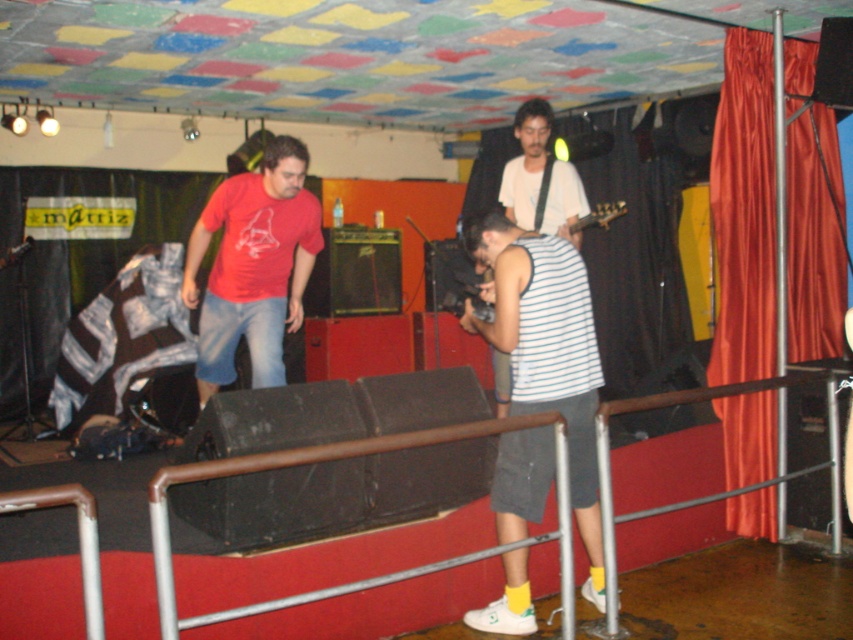
Question: Which point is farther to the camera?

Choices:
 (A) 552,268
 (B) 505,168

Answer: (B)

Question: In this image, where is white striped tank top at center located relative to matte red t-shirt at center?

Choices:
 (A) left
 (B) right

Answer: (B)

Question: Among these points, which one is nearest to the camera?

Choices:
 (A) (544, 204)
 (B) (277, 314)
 (C) (640, 451)
 (D) (595, 513)

Answer: (D)

Question: Which of the following is the closest to the observer?

Choices:
 (A) white striped tank top at center
 (B) white matte shirt at center
 (C) metal at center
 (D) velvet red curtain at right

Answer: (C)

Question: Can you confirm if metal at center is positioned to the right of matte red t-shirt at center?

Choices:
 (A) no
 (B) yes

Answer: (B)

Question: Does velvet red curtain at right appear under white striped tank top at center?

Choices:
 (A) no
 (B) yes

Answer: (A)